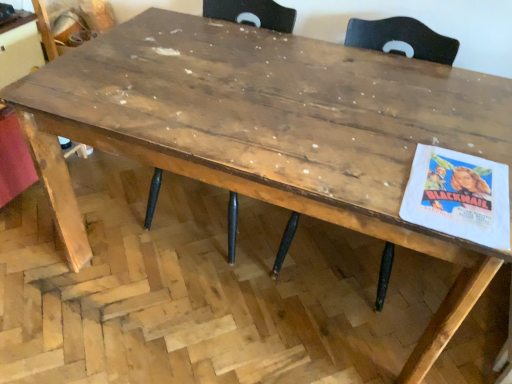
Measure the distance between wooden chair at center, marked as the 2th chair in a right-to-left arrangement, and camera.

wooden chair at center, marked as the 2th chair in a right-to-left arrangement, is 1.76 meters away from camera.

The height and width of the screenshot is (384, 512). What do you see at coordinates (252, 13) in the screenshot? I see `wooden chair at center, marked as the 2th chair in a right-to-left arrangement` at bounding box center [252, 13].

Find the location of `wooden chair at center, which ranks as the 1th chair in left-to-right order`. wooden chair at center, which ranks as the 1th chair in left-to-right order is located at coordinates (252, 13).

What is the approximate width of wooden chair at center, marked as the 2th chair in a right-to-left arrangement?

The width of wooden chair at center, marked as the 2th chair in a right-to-left arrangement, is 24.92 inches.

Locate an element on the screen. wooden chair at center, which is the 1th chair from right to left is located at coordinates (402, 37).

The image size is (512, 384). What do you see at coordinates (402, 37) in the screenshot?
I see `wooden chair at center, which appears as the 2th chair when viewed from the left` at bounding box center [402, 37].

The image size is (512, 384). In order to click on wooden chair at center, marked as the 2th chair in a right-to-left arrangement in this screenshot , I will do `click(252, 13)`.

Based on their positions, is wooden chair at center, which ranks as the 1th chair in left-to-right order, located to the left or right of wooden chair at center, which is the 1th chair from right to left?

Clearly, wooden chair at center, which ranks as the 1th chair in left-to-right order, is on the left of wooden chair at center, which is the 1th chair from right to left, in the image.

Is the position of wooden chair at center, marked as the 2th chair in a right-to-left arrangement, more distant than that of wooden chair at center, which is the 1th chair from right to left?

Yes, it is behind wooden chair at center, which is the 1th chair from right to left.

Is point (247, 9) behind point (381, 48)?

Yes.

From the image's perspective, which one is positioned higher, wooden chair at center, marked as the 2th chair in a right-to-left arrangement, or wooden chair at center, which appears as the 2th chair when viewed from the left?

wooden chair at center, marked as the 2th chair in a right-to-left arrangement, is shown above in the image.

Consider the image. From a real-world perspective, relative to wooden chair at center, which is the 1th chair from right to left, is wooden chair at center, which ranks as the 1th chair in left-to-right order, vertically above or below?

In terms of real-world spatial position, wooden chair at center, which ranks as the 1th chair in left-to-right order, is below wooden chair at center, which is the 1th chair from right to left.

Looking at their sizes, would you say wooden chair at center, marked as the 2th chair in a right-to-left arrangement, is wider or thinner than wooden chair at center, which is the 1th chair from right to left?

wooden chair at center, marked as the 2th chair in a right-to-left arrangement, is wider than wooden chair at center, which is the 1th chair from right to left.

Which of these two, wooden chair at center, which ranks as the 1th chair in left-to-right order, or wooden chair at center, which appears as the 2th chair when viewed from the left, stands taller?

wooden chair at center, which ranks as the 1th chair in left-to-right order.

In terms of size, does wooden chair at center, which ranks as the 1th chair in left-to-right order, appear bigger or smaller than wooden chair at center, which is the 1th chair from right to left?

Considering their sizes, wooden chair at center, which ranks as the 1th chair in left-to-right order, takes up more space than wooden chair at center, which is the 1th chair from right to left.

Can wooden chair at center, which is the 1th chair from right to left, be found inside wooden chair at center, marked as the 2th chair in a right-to-left arrangement?

Actually, wooden chair at center, which is the 1th chair from right to left, is outside wooden chair at center, marked as the 2th chair in a right-to-left arrangement.

Is wooden chair at center, marked as the 2th chair in a right-to-left arrangement, not near wooden chair at center, which appears as the 2th chair when viewed from the left?

Actually, wooden chair at center, marked as the 2th chair in a right-to-left arrangement, and wooden chair at center, which appears as the 2th chair when viewed from the left, are a little close together.

Is wooden chair at center, marked as the 2th chair in a right-to-left arrangement, positioned with its back to wooden chair at center, which appears as the 2th chair when viewed from the left?

That's not correct — wooden chair at center, marked as the 2th chair in a right-to-left arrangement, is not looking away from wooden chair at center, which appears as the 2th chair when viewed from the left.

The height and width of the screenshot is (384, 512). In order to click on chair on the left of wooden chair at center, which is the 1th chair from right to left in this screenshot , I will do `click(252, 13)`.

Which object is positioned more to the left, wooden chair at center, which is the 1th chair from right to left, or wooden chair at center, marked as the 2th chair in a right-to-left arrangement?

wooden chair at center, marked as the 2th chair in a right-to-left arrangement, is more to the left.

Is the depth of wooden chair at center, which is the 1th chair from right to left, less than that of wooden chair at center, which ranks as the 1th chair in left-to-right order?

That is True.

Is point (405, 36) in front of point (156, 191)?

Yes, it is.

From the image's perspective, who appears lower, wooden chair at center, which is the 1th chair from right to left, or wooden chair at center, marked as the 2th chair in a right-to-left arrangement?

wooden chair at center, which is the 1th chair from right to left, appears lower in the image.

From a real-world perspective, is wooden chair at center, which is the 1th chair from right to left, under wooden chair at center, marked as the 2th chair in a right-to-left arrangement?

No, from a real-world perspective, wooden chair at center, which is the 1th chair from right to left, is not below wooden chair at center, marked as the 2th chair in a right-to-left arrangement.

Considering the sizes of wooden chair at center, which is the 1th chair from right to left, and wooden chair at center, which ranks as the 1th chair in left-to-right order, in the image, is wooden chair at center, which is the 1th chair from right to left, wider or thinner than wooden chair at center, which ranks as the 1th chair in left-to-right order,?

wooden chair at center, which is the 1th chair from right to left, is thinner than wooden chair at center, which ranks as the 1th chair in left-to-right order.

Does wooden chair at center, which appears as the 2th chair when viewed from the left, have a lesser height compared to wooden chair at center, which ranks as the 1th chair in left-to-right order?

Yes, wooden chair at center, which appears as the 2th chair when viewed from the left, is shorter than wooden chair at center, which ranks as the 1th chair in left-to-right order.

Who is bigger, wooden chair at center, which appears as the 2th chair when viewed from the left, or wooden chair at center, marked as the 2th chair in a right-to-left arrangement?

With larger size is wooden chair at center, marked as the 2th chair in a right-to-left arrangement.

Is wooden chair at center, which appears as the 2th chair when viewed from the left, outside of wooden chair at center, which ranks as the 1th chair in left-to-right order?

wooden chair at center, which appears as the 2th chair when viewed from the left, lies outside wooden chair at center, which ranks as the 1th chair in left-to-right order,'s area.

In the scene shown: Is wooden chair at center, which appears as the 2th chair when viewed from the left, in contact with wooden chair at center, marked as the 2th chair in a right-to-left arrangement?

No.

Could you tell me if wooden chair at center, which is the 1th chair from right to left, is turned towards wooden chair at center, which ranks as the 1th chair in left-to-right order?

No.

How many degrees apart are the facing directions of wooden chair at center, which is the 1th chair from right to left, and wooden chair at center, marked as the 2th chair in a right-to-left arrangement?

They differ by 0.000149 degrees in their facing directions.

The image size is (512, 384). Find the location of `chair in front of the wooden chair at center, which ranks as the 1th chair in left-to-right order`. chair in front of the wooden chair at center, which ranks as the 1th chair in left-to-right order is located at coordinates (402, 37).

Locate an element on the screen. The width and height of the screenshot is (512, 384). chair located in front of the wooden chair at center, which ranks as the 1th chair in left-to-right order is located at coordinates (402, 37).

The width and height of the screenshot is (512, 384). In order to click on chair below the wooden chair at center, which appears as the 2th chair when viewed from the left (from a real-world perspective) in this screenshot , I will do `click(252, 13)`.